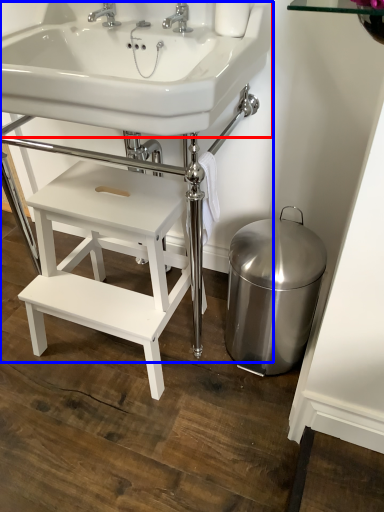
Question: Which of the following is the closest to the observer, sink (highlighted by a red box) or sink (highlighted by a blue box)?

Choices:
 (A) sink
 (B) sink

Answer: (A)